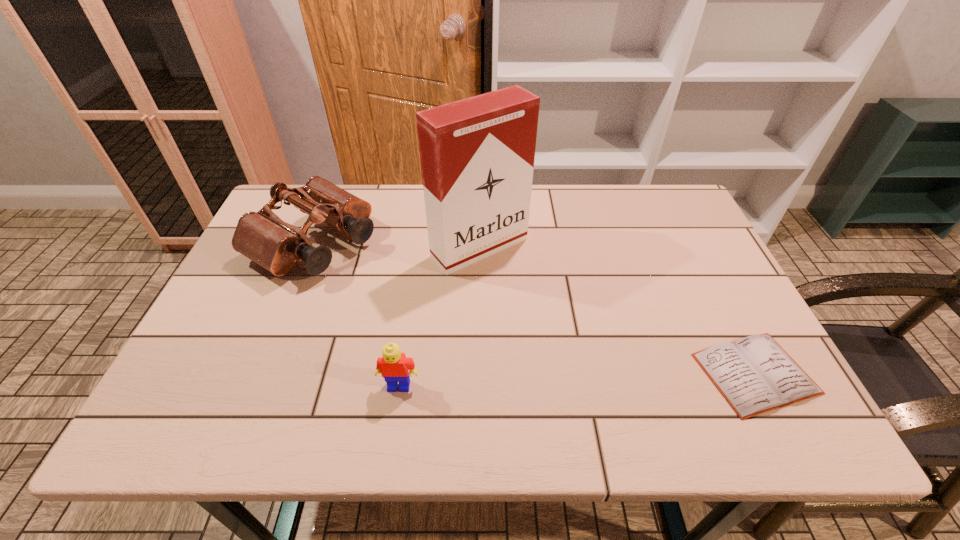
Identify the location of the third tallest object. This screenshot has height=540, width=960. (393, 365).

Where is `diary`? diary is located at coordinates pos(755,374).

Locate an element on the screen. the shortest object is located at coordinates (755, 374).

At what (x,y) coordinates should I click in order to perform the action: click on cigarette_case. Please return your answer as a coordinate pair (x, y). The width and height of the screenshot is (960, 540). Looking at the image, I should click on (477, 154).

You are a GUI agent. You are given a task and a screenshot of the screen. Output one action in this format:
    pyautogui.click(x=<x>, y=<y>)
    Task: Click on the third shortest object
    
    Given the screenshot: What is the action you would take?
    pyautogui.click(x=264, y=238)

Identify the location of binoculars. (264, 238).

The height and width of the screenshot is (540, 960). What are the coordinates of `free point located 0.400m on the back of the rightmost object` in the screenshot? It's located at (680, 226).

You are a GUI agent. You are given a task and a screenshot of the screen. Output one action in this format:
    pyautogui.click(x=<x>, y=<y>)
    Task: Click on the free spot located on the front-facing side of the tallest object
    This screenshot has height=540, width=960.
    Given the screenshot: What is the action you would take?
    pyautogui.click(x=577, y=339)

You are a GUI agent. You are given a task and a screenshot of the screen. Output one action in this format:
    pyautogui.click(x=<x>, y=<y>)
    Task: Click on the vacant space situated 0.070m on the front-facing side of the tallest object
    The image size is (960, 540).
    Given the screenshot: What is the action you would take?
    pyautogui.click(x=524, y=286)

Find the location of `free spot located 0.230m on the front-facing side of the tallest object`. free spot located 0.230m on the front-facing side of the tallest object is located at coordinates (x=565, y=327).